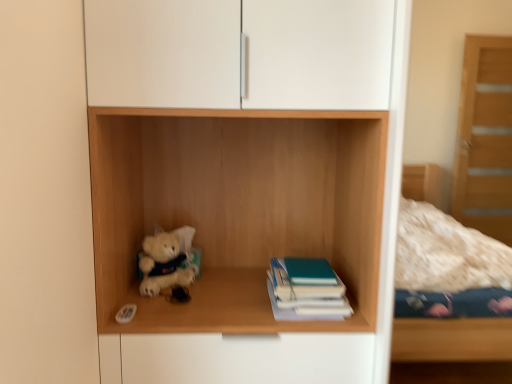
Question: Can you confirm if teal matte book at center is positioned to the left of wooden shelf at center?

Choices:
 (A) no
 (B) yes

Answer: (A)

Question: From the image's perspective, does teal matte book at center appear higher than wooden shelf at center?

Choices:
 (A) yes
 (B) no

Answer: (B)

Question: Is teal matte book at center to the right of wooden shelf at center from the viewer's perspective?

Choices:
 (A) no
 (B) yes

Answer: (B)

Question: Is teal matte book at center looking in the opposite direction of wooden shelf at center?

Choices:
 (A) no
 (B) yes

Answer: (B)

Question: Is teal matte book at center directly adjacent to wooden shelf at center?

Choices:
 (A) no
 (B) yes

Answer: (A)

Question: Considering the positions of fluffy white teddy bear at lower left and teal matte book at center in the image, is fluffy white teddy bear at lower left wider or thinner than teal matte book at center?

Choices:
 (A) wide
 (B) thin

Answer: (B)

Question: Considering their positions, is fluffy white teddy bear at lower left located in front of or behind teal matte book at center?

Choices:
 (A) front
 (B) behind

Answer: (B)

Question: Is fluffy white teddy bear at lower left taller or shorter than teal matte book at center?

Choices:
 (A) short
 (B) tall

Answer: (B)

Question: Is point (175, 276) positioned closer to the camera than point (314, 309)?

Choices:
 (A) closer
 (B) farther

Answer: (B)

Question: From a real-world perspective, is fluffy white teddy bear at lower left physically located above or below wooden shelf at center?

Choices:
 (A) below
 (B) above

Answer: (A)

Question: In the image, is fluffy white teddy bear at lower left positioned in front of or behind wooden shelf at center?

Choices:
 (A) behind
 (B) front

Answer: (A)

Question: Is fluffy white teddy bear at lower left taller or shorter than wooden shelf at center?

Choices:
 (A) short
 (B) tall

Answer: (A)

Question: In terms of width, does fluffy white teddy bear at lower left look wider or thinner when compared to wooden shelf at center?

Choices:
 (A) wide
 (B) thin

Answer: (B)

Question: Considering the positions of wooden shelf at center and fluffy white teddy bear at lower left in the image, is wooden shelf at center taller or shorter than fluffy white teddy bear at lower left?

Choices:
 (A) tall
 (B) short

Answer: (A)

Question: Considering the positions of wooden shelf at center and fluffy white teddy bear at lower left in the image, is wooden shelf at center bigger or smaller than fluffy white teddy bear at lower left?

Choices:
 (A) small
 (B) big

Answer: (B)